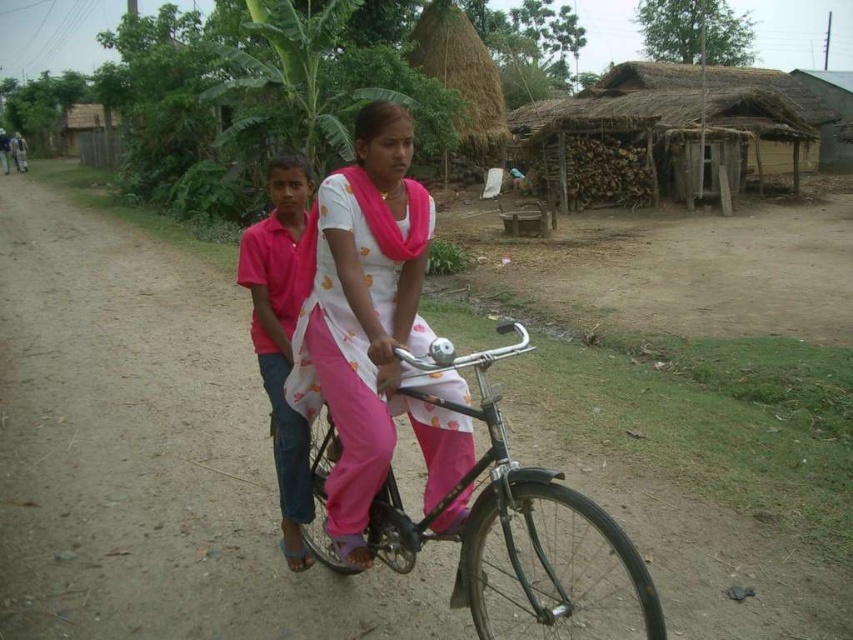
Question: Among these points, which one is nearest to the camera?

Choices:
 (A) (306, 560)
 (B) (358, 212)
 (C) (630, 83)
 (D) (734, 529)

Answer: (B)

Question: Does thatched roof hut at upper right have a larger size compared to metallic silver bicycle at center?

Choices:
 (A) no
 (B) yes

Answer: (B)

Question: Which point is farther to the camera?

Choices:
 (A) pink satin dress at center
 (B) metallic silver bicycle at center
 (C) pink cotton shirt at center

Answer: (C)

Question: Does brown dirt track at center appear on the left side of pink cotton shirt at center?

Choices:
 (A) yes
 (B) no

Answer: (A)

Question: Which object is positioned farthest from the pink satin dress at center?

Choices:
 (A) thatched roof hut at upper right
 (B) metallic silver bicycle at center
 (C) pink cotton shirt at center

Answer: (A)

Question: Is brown dirt track at center to the left of metallic silver bicycle at center from the viewer's perspective?

Choices:
 (A) yes
 (B) no

Answer: (A)